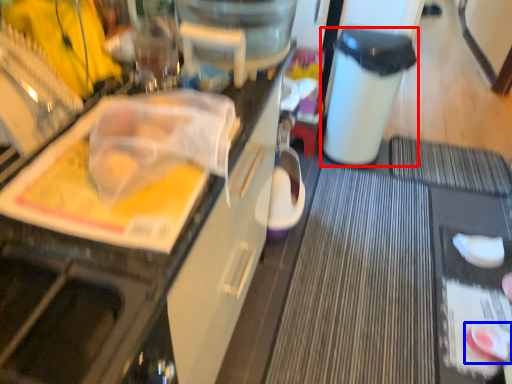
Question: Which object appears closest to the camera in this image, trash bin/can (highlighted by a red box) or food (highlighted by a blue box)?

Choices:
 (A) trash bin/can
 (B) food

Answer: (B)